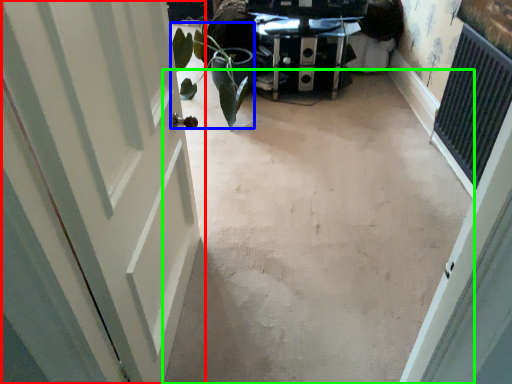
Question: Based on their relative distances, which object is nearer to door (highlighted by a red box)? Choose from plant (highlighted by a blue box) and concrete (highlighted by a green box).

Choices:
 (A) plant
 (B) concrete

Answer: (B)